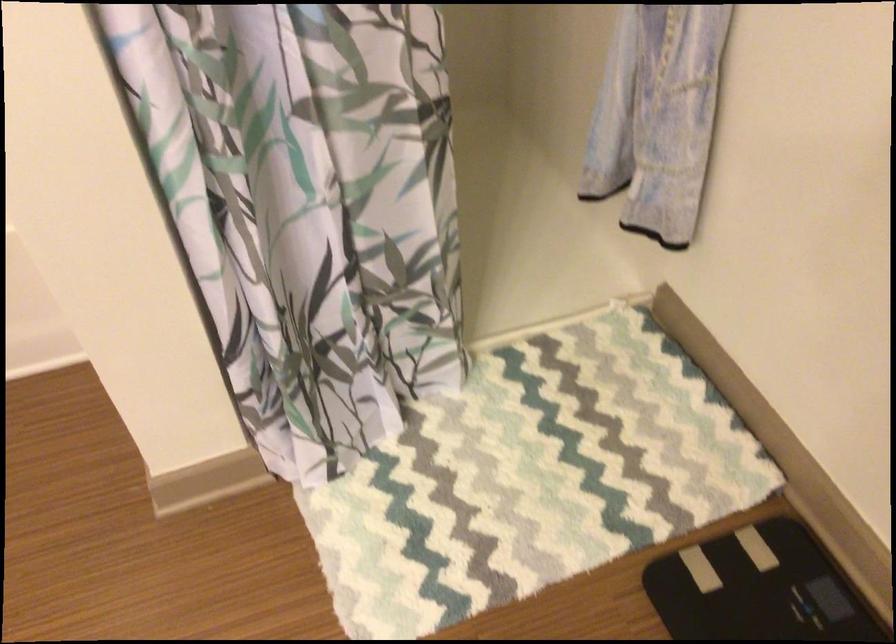
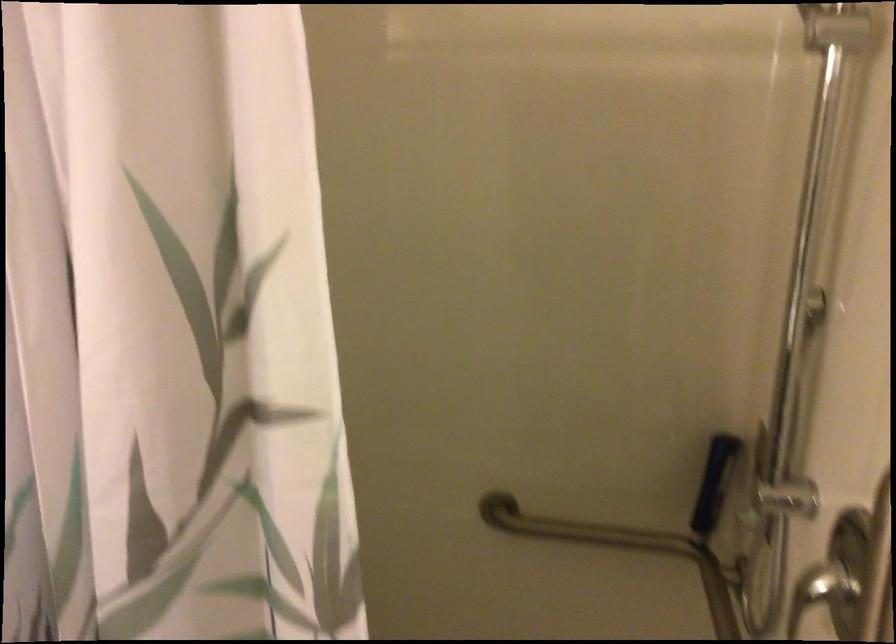
Based on the continuous images, in which direction is the camera rotating?

The rotation direction of the camera is left-up.